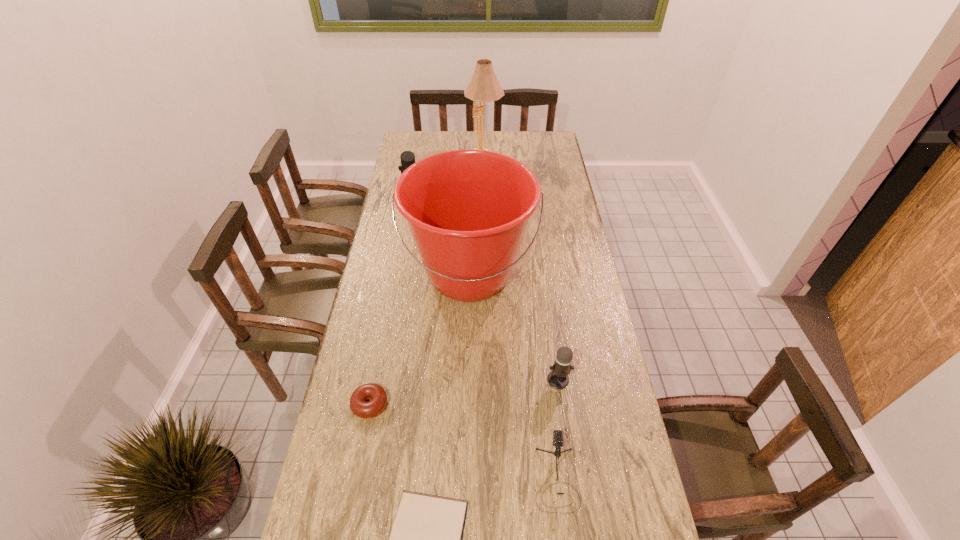
Locate which microphone ranks in proximity to the Bible. Please provide its 2D coordinates. Your answer should be formatted as a tuple, i.e. [(x, y)], where the tuple contains the x and y coordinates of a point satisfying the conditions above.

[(557, 434)]

Point out which microphone is positioned as the nearest to the second shortest microphone. Please provide its 2D coordinates. Your answer should be formatted as a tuple, i.e. [(x, y)], where the tuple contains the x and y coordinates of a point satisfying the conditions above.

[(557, 434)]

This screenshot has width=960, height=540. Find the location of `free space that satisfies the following two spatial constraints: 1. with the handle attached to the rim of the sixth shortest object; 2. on the right side of the fourth shortest object`. free space that satisfies the following two spatial constraints: 1. with the handle attached to the rim of the sixth shortest object; 2. on the right side of the fourth shortest object is located at coordinates (467, 380).

Locate an element on the screen. The height and width of the screenshot is (540, 960). vacant space that satisfies the following two spatial constraints: 1. with the handle attached to the rim of the fifth nearest object; 2. on the right side of the fourth shortest object is located at coordinates (467, 380).